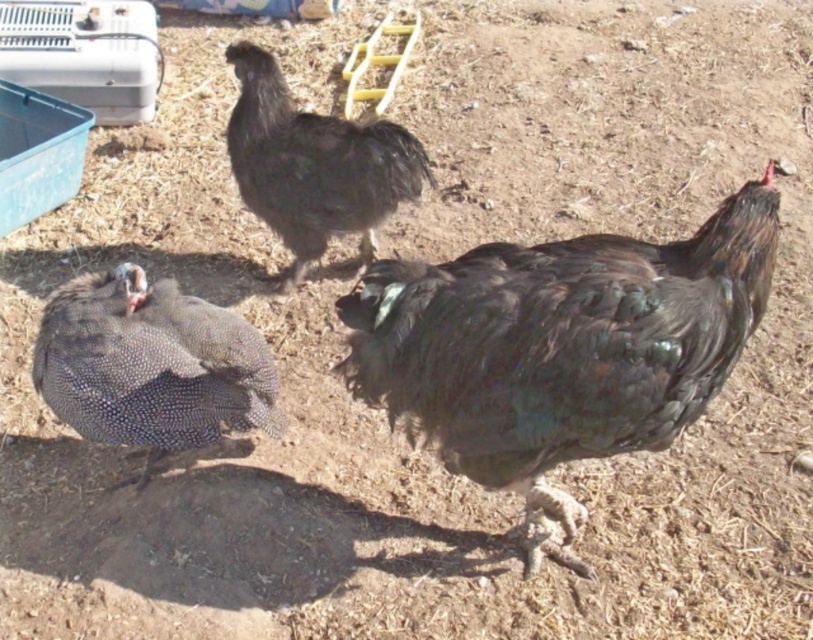
You are a farmer observing the shiny black feathers at center and the black feathered chicken at center in your farmyard. Which object has a greater width?

The shiny black feathers at center has a greater width than the black feathered chicken at center.

You are a farmer checking the coop and notice the speckled feathered guinea fowl at lower left and the black feathered chicken at center. Which bird is closer to the entrance of the coop?

The speckled feathered guinea fowl at lower left is closer to the entrance of the coop because it is in front of the black feathered chicken at center, indicating it is nearer to the viewer.